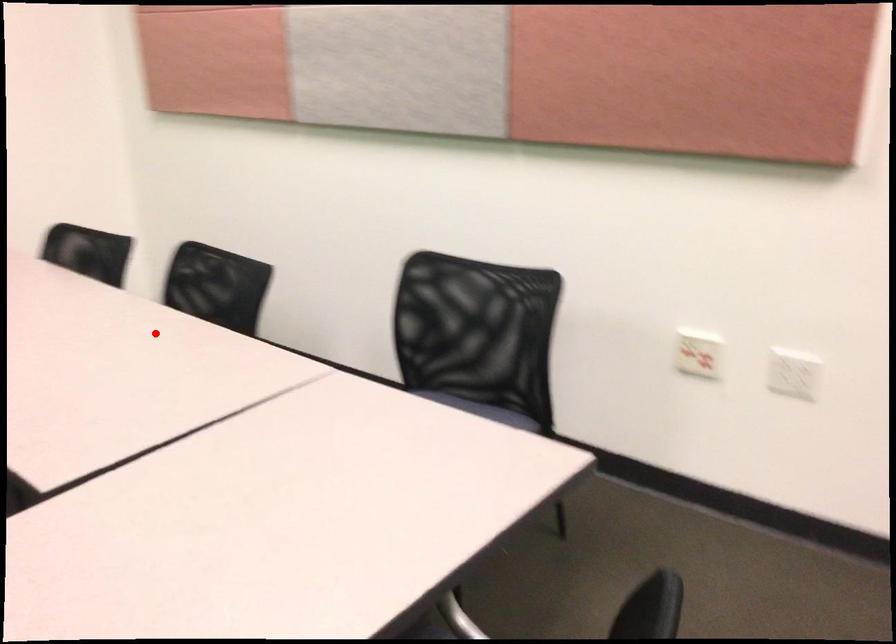
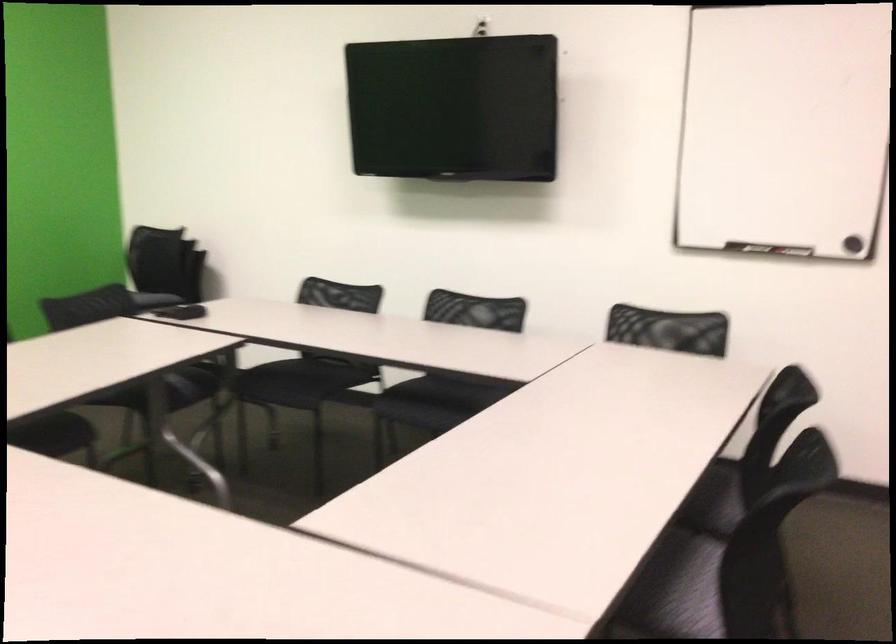
Locate, in the second image, the point that corresponds to the highlighted location in the first image.

(722, 491)